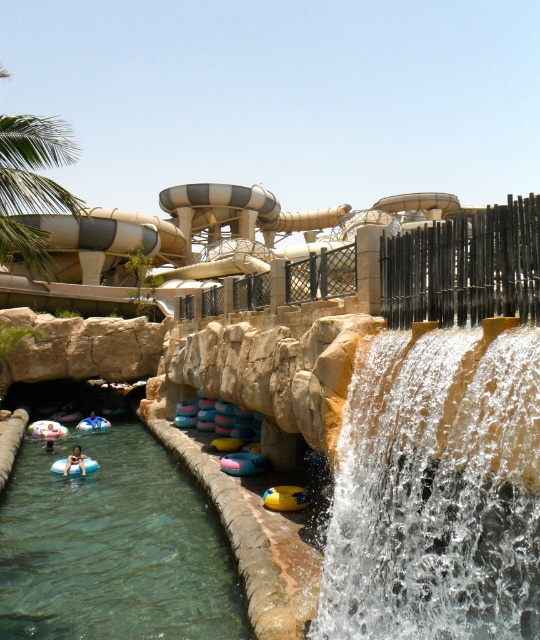
Question: Is green leafy palm tree at upper left thinner than light blue rubber ring at lower left?

Choices:
 (A) yes
 (B) no

Answer: (B)

Question: Which is nearer to the light blue rubber ring at lower left?

Choices:
 (A) translucent blue rubber ring at lower left
 (B) green leafy palm tree at upper left
 (C) clear water cascade at center

Answer: (A)

Question: Which point is closer to the camera?

Choices:
 (A) translucent blue rubber ring at lower left
 (B) green leafy palm tree at upper left
 (C) clear water cascade at center
 (D) light blue rubber ring at lower left

Answer: (C)

Question: Where is clear water cascade at center located in relation to green leafy palm tree at upper left in the image?

Choices:
 (A) below
 (B) above

Answer: (A)

Question: Can you confirm if translucent blue rubber ring at lower left is bigger than light blue rubber ring at lower left?

Choices:
 (A) yes
 (B) no

Answer: (A)

Question: Among these points, which one is nearest to the camera?

Choices:
 (A) (66, 467)
 (B) (164, 584)
 (C) (333, 552)

Answer: (C)